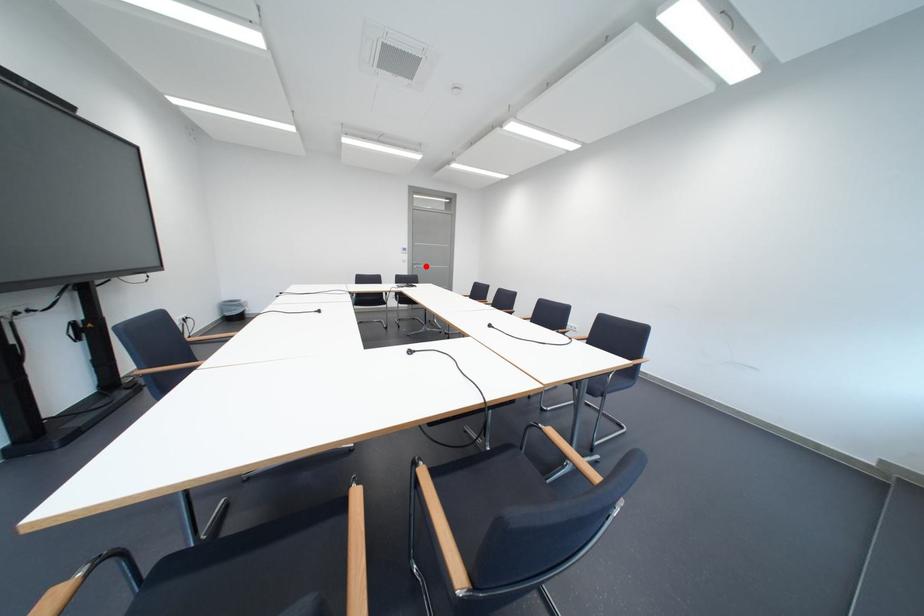
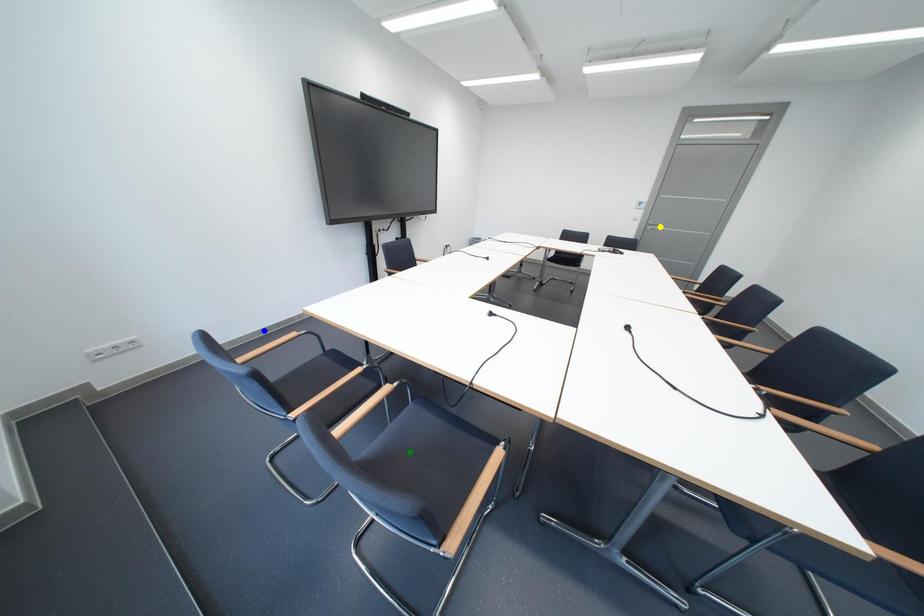
Question: I am providing you with two images of the same scene from different viewpoints. A red point is marked on the first image. You are given multiple points on the second image. Which point in image 2 represents the same 3d spot as the red point in image 1?

Choices:
 (A) green point
 (B) yellow point
 (C) blue point

Answer: (B)